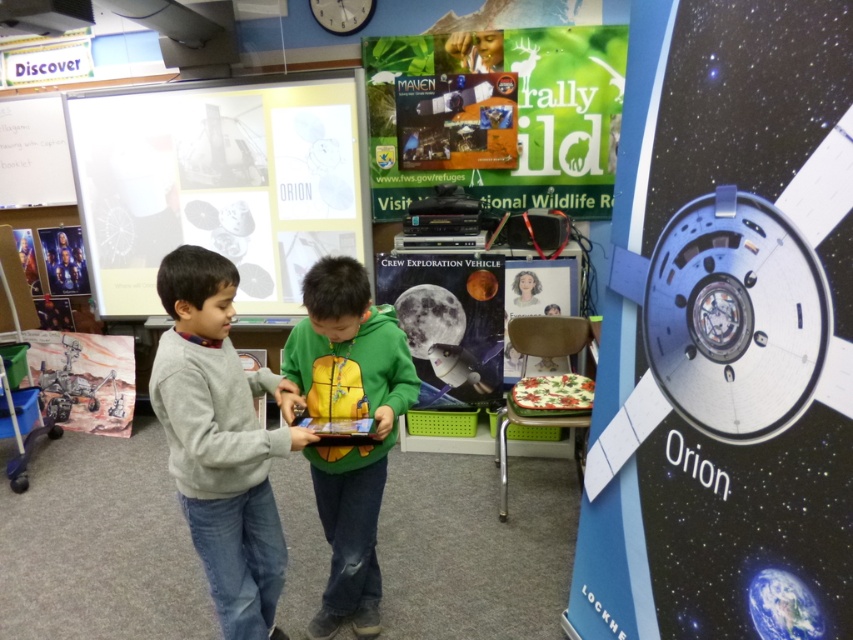
Question: Is gray sweater at center smaller than green fuzzy hoodie at center?

Choices:
 (A) no
 (B) yes

Answer: (B)

Question: Which object appears closest to the camera in this image?

Choices:
 (A) green fuzzy hoodie at center
 (B) matte cardboard poster at center
 (C) gray sweater at center

Answer: (C)

Question: Is matte cardboard poster at center smaller than metallic silver poster at upper left?

Choices:
 (A) no
 (B) yes

Answer: (A)

Question: Which object is the closest to the matte cardboard poster at center?

Choices:
 (A) green matte poster at upper center
 (B) metallic silver spaceship at center

Answer: (B)

Question: Estimate the real-world distances between objects in this image. Which object is farther from the matte cardboard poster at center?

Choices:
 (A) metallic silver poster at upper left
 (B) green fuzzy hoodie at center

Answer: (A)

Question: Considering the relative positions of green fuzzy hoodie at center and matte cardboard poster at center in the image provided, where is green fuzzy hoodie at center located with respect to matte cardboard poster at center?

Choices:
 (A) left
 (B) right

Answer: (A)